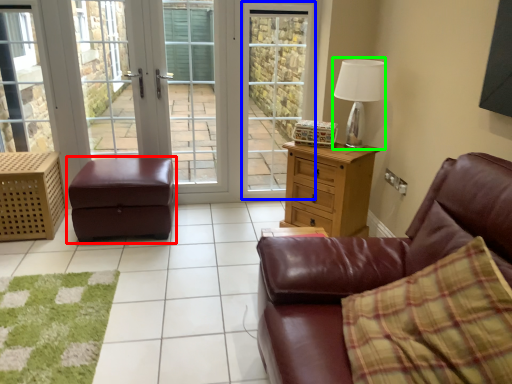
Question: Which object is positioned closest to table (highlighted by a red box)? Select from screen door (highlighted by a blue box) and table lamp (highlighted by a green box).

Choices:
 (A) screen door
 (B) table lamp

Answer: (A)